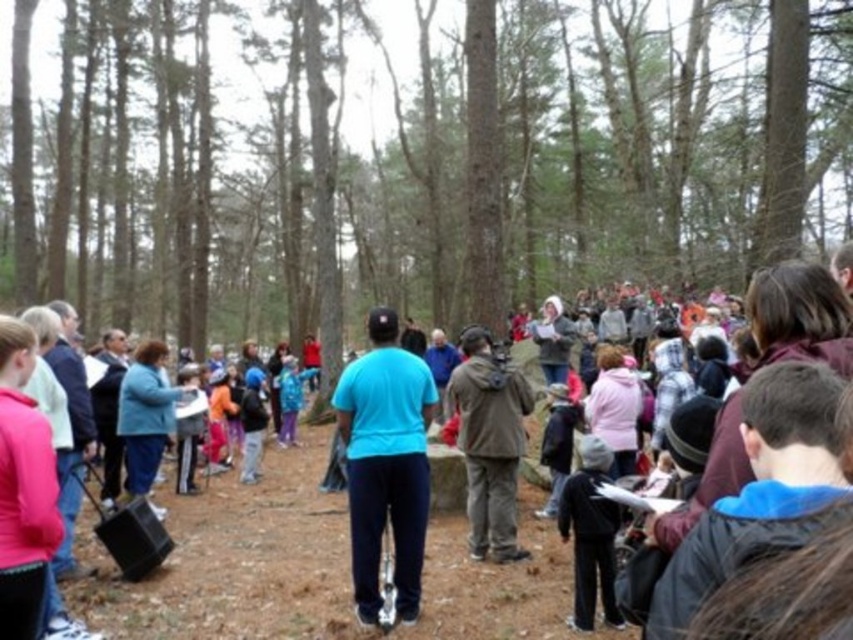
You are standing at point (561, 492) and want to move to point (222, 556). Is the path between these two points clear of any obstacles?

Point (222, 556) is behind point (561, 492), so the path between them is blocked by the speaker and the group of people gathered around.

You are part of the group facing the speaker in the wooded area. Which object, the brown textured tree at center or the blue matte shirt at center, is positioned to the right from your perspective?

The blue matte shirt at center is positioned to the right of the brown textured tree at center, so from your perspective facing the speaker, the blue matte shirt at center would be on the right side.